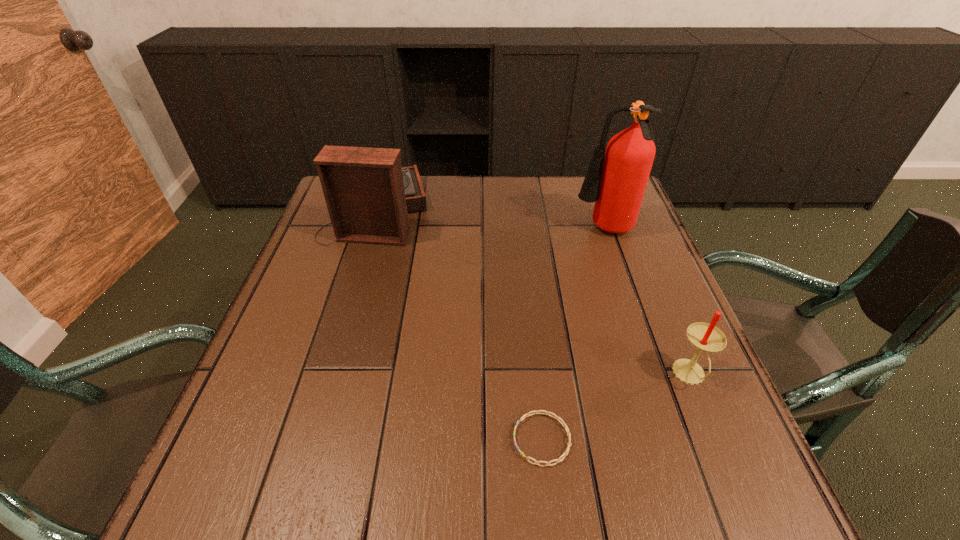
At what (x,y) coordinates should I click in order to perform the action: click on vacant region between the phonograph record and the second object from left to right. Please return your answer as a coordinate pair (x, y). The width and height of the screenshot is (960, 540). Looking at the image, I should click on (460, 325).

The width and height of the screenshot is (960, 540). I want to click on vacant space in between the tallest object and the shortest object, so click(573, 335).

Locate an element on the screen. The width and height of the screenshot is (960, 540). free space between the leftmost object and the tallest object is located at coordinates (491, 220).

The image size is (960, 540). Find the location of `vacant area that lies between the candle and the tallest object`. vacant area that lies between the candle and the tallest object is located at coordinates (647, 303).

You are a GUI agent. You are given a task and a screenshot of the screen. Output one action in this format:
    pyautogui.click(x=<x>, y=<y>)
    Task: Click on the free space between the tallest object and the second nearest object
    This screenshot has height=540, width=960.
    Given the screenshot: What is the action you would take?
    pyautogui.click(x=647, y=303)

The image size is (960, 540). Find the location of `vacant area that lies between the candle and the nearest object`. vacant area that lies between the candle and the nearest object is located at coordinates (616, 407).

Find the location of `free space between the candle and the tallest object`. free space between the candle and the tallest object is located at coordinates (647, 303).

At what (x,y) coordinates should I click in order to perform the action: click on vacant region between the leftmost object and the third object from right to left. Please return your answer as a coordinate pair (x, y). The width and height of the screenshot is (960, 540). Looking at the image, I should click on (460, 325).

This screenshot has height=540, width=960. I want to click on vacant area that lies between the bracelet and the tallest object, so click(x=573, y=335).

This screenshot has height=540, width=960. I want to click on object identified as the third closest to the third farthest object, so click(x=368, y=194).